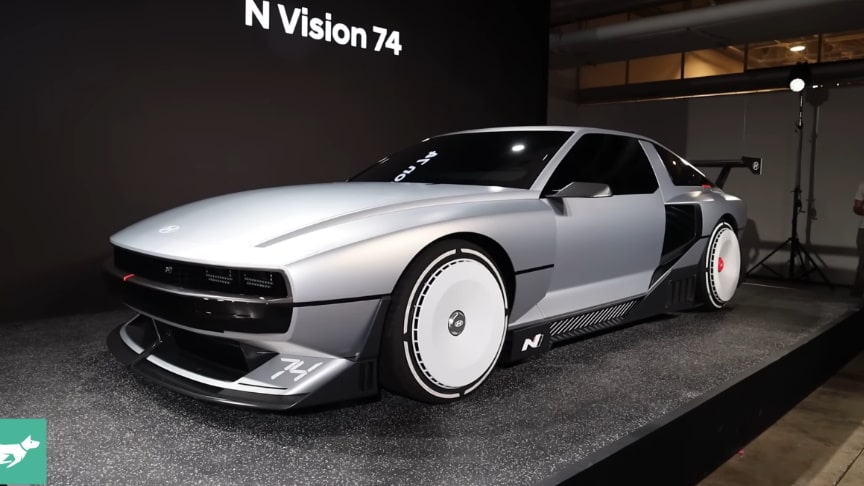
You are a GUI agent. You are given a task and a screenshot of the screen. Output one action in this format:
    pyautogui.click(x=<x>, y=<y>)
    Task: Click on the window
    
    Given the screenshot: What is the action you would take?
    pyautogui.click(x=703, y=64)